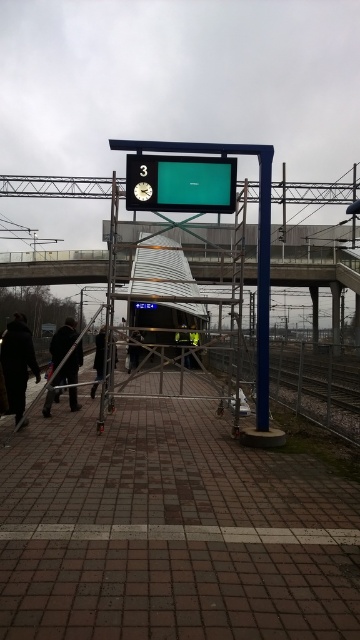
Can you confirm if dark brown leather jacket at lower left is taller than reflective silver helmet at center?

Yes, dark brown leather jacket at lower left is taller than reflective silver helmet at center.

Who is taller, dark brown leather jacket at lower left or reflective silver helmet at center?

dark brown leather jacket at lower left

Is point (59, 378) positioned behind point (189, 356)?

No, it is in front of (189, 356).

Where is `dark brown leather jacket at lower left`? Image resolution: width=360 pixels, height=640 pixels. dark brown leather jacket at lower left is located at coordinates (62, 340).

Is dark brown leather coat at lower left positioned at the back of dark brown leather jacket at lower left?

No.

Can you confirm if dark brown leather coat at lower left is bigger than dark brown leather jacket at lower left?

Actually, dark brown leather coat at lower left might be smaller than dark brown leather jacket at lower left.

Is point (28, 337) behind point (51, 401)?

No, (28, 337) is in front of (51, 401).

I want to click on dark brown leather coat at lower left, so click(18, 364).

Who is lower down, dark brown leather coat at lower left or dark gray uniform at center?

dark gray uniform at center is lower down.

Identify the location of dark brown leather coat at lower left. The height and width of the screenshot is (640, 360). (18, 364).